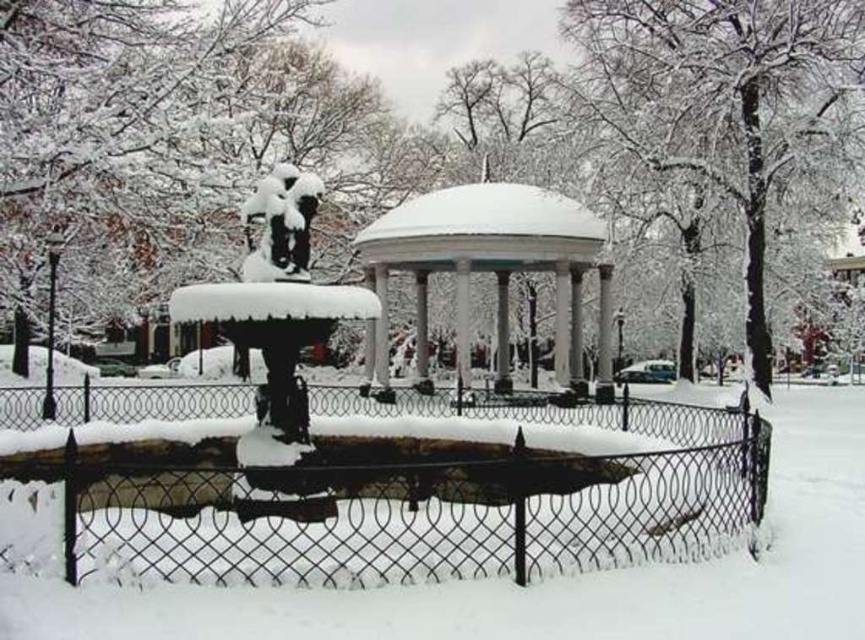
Locate an element on the screen. This screenshot has width=865, height=640. black wire fence at center is located at coordinates (388, 483).

Is black wire fence at center to the left of snow-covered statue at center from the viewer's perspective?

No, black wire fence at center is not to the left of snow-covered statue at center.

Who is more distant from viewer, (67, 470) or (317, 177)?

Positioned behind is point (317, 177).

The image size is (865, 640). I want to click on black wire fence at center, so click(388, 483).

Image resolution: width=865 pixels, height=640 pixels. What do you see at coordinates (388, 483) in the screenshot? I see `black wire fence at center` at bounding box center [388, 483].

Which is below, black wire fence at center or white glossy gazebo at center?

black wire fence at center

Who is more forward, (36, 435) or (590, 216)?

Point (36, 435) is more forward.

Find the location of a particular element. This screenshot has height=640, width=865. black wire fence at center is located at coordinates (388, 483).

Between black wire fence at center and snow-covered bronze statue at center, which one has more height?

With more height is snow-covered bronze statue at center.

Describe the element at coordinates (388, 483) in the screenshot. This screenshot has width=865, height=640. I see `black wire fence at center` at that location.

Who is more distant from viewer, (x=356, y=445) or (x=263, y=499)?

Positioned behind is point (x=356, y=445).

Image resolution: width=865 pixels, height=640 pixels. In order to click on black wire fence at center in this screenshot , I will do `click(388, 483)`.